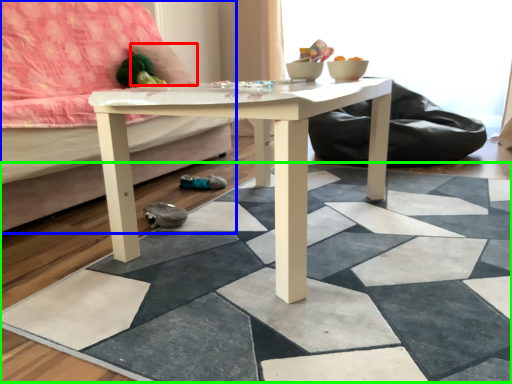
Question: Which is nearer to the pillow (highlighted by a red box)? studio couch (highlighted by a blue box) or tile (highlighted by a green box).

Choices:
 (A) studio couch
 (B) tile

Answer: (A)